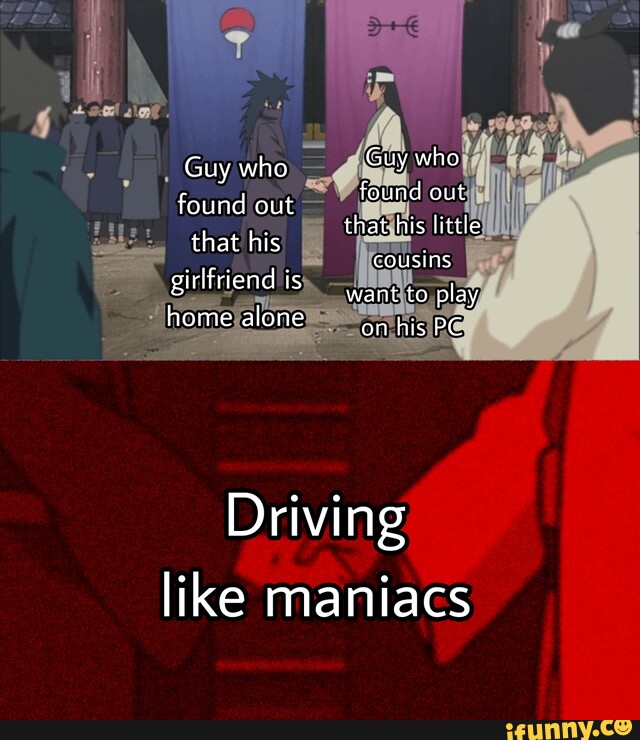
Where is `floor`? The height and width of the screenshot is (740, 640). floor is located at coordinates (319, 317).